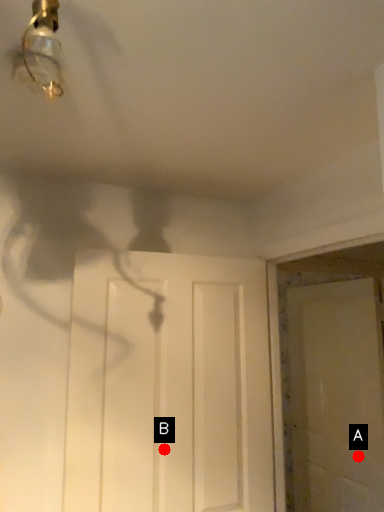
Question: Two points are circled on the image, labeled by A and B beside each circle. Which point is closer to the camera?

Choices:
 (A) A is closer
 (B) B is closer

Answer: (B)